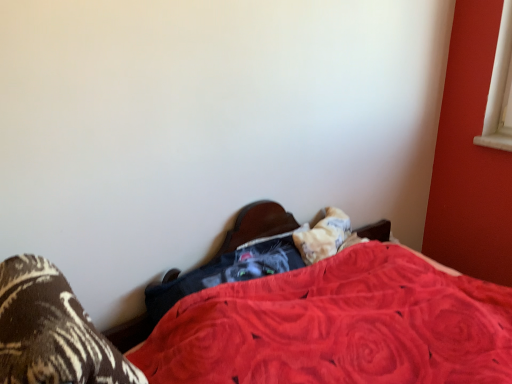
Question: Does fluffy white pillow at lower center have a smaller size compared to brown textured socks at lower left?

Choices:
 (A) yes
 (B) no

Answer: (A)

Question: Can we say fluffy white pillow at lower center lies outside brown textured socks at lower left?

Choices:
 (A) yes
 (B) no

Answer: (A)

Question: Considering the relative positions of fluffy white pillow at lower center and brown textured socks at lower left in the image provided, is fluffy white pillow at lower center to the right of brown textured socks at lower left from the viewer's perspective?

Choices:
 (A) yes
 (B) no

Answer: (A)

Question: Does fluffy white pillow at lower center have a larger size compared to brown textured socks at lower left?

Choices:
 (A) yes
 (B) no

Answer: (B)

Question: Could brown textured socks at lower left be considered to be inside fluffy white pillow at lower center?

Choices:
 (A) yes
 (B) no

Answer: (B)

Question: Does fluffy white pillow at lower center have a lesser height compared to brown textured socks at lower left?

Choices:
 (A) yes
 (B) no

Answer: (A)

Question: Is velvet red blanket at center beside fluffy white pillow at lower center?

Choices:
 (A) yes
 (B) no

Answer: (B)

Question: Can you confirm if velvet red blanket at center is positioned to the left of fluffy white pillow at lower center?

Choices:
 (A) yes
 (B) no

Answer: (B)

Question: From a real-world perspective, is velvet red blanket at center under fluffy white pillow at lower center?

Choices:
 (A) no
 (B) yes

Answer: (B)

Question: Is velvet red blanket at center looking in the opposite direction of fluffy white pillow at lower center?

Choices:
 (A) yes
 (B) no

Answer: (A)

Question: Is the depth of velvet red blanket at center greater than that of fluffy white pillow at lower center?

Choices:
 (A) yes
 (B) no

Answer: (B)

Question: From the image's perspective, is velvet red blanket at center below fluffy white pillow at lower center?

Choices:
 (A) yes
 (B) no

Answer: (A)

Question: Are brown textured socks at lower left and fluffy white pillow at lower center making contact?

Choices:
 (A) no
 (B) yes

Answer: (A)